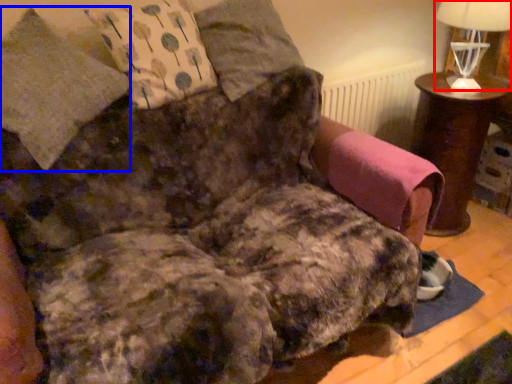
Question: Which object is closer to the camera taking this photo, table lamp (highlighted by a red box) or pillow (highlighted by a blue box)?

Choices:
 (A) table lamp
 (B) pillow

Answer: (B)